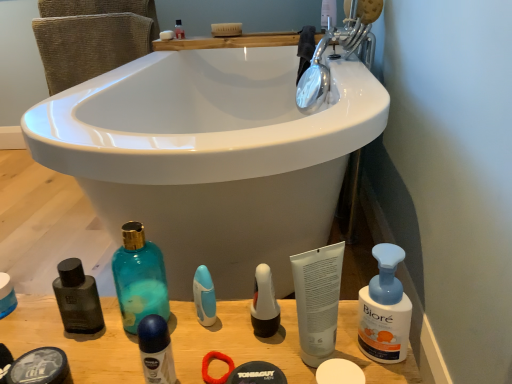
Where is `vacant area that is situated to the right of blue plastic toothbrush at center, which appears as the 3th toiletry when viewed from the right`? vacant area that is situated to the right of blue plastic toothbrush at center, which appears as the 3th toiletry when viewed from the right is located at coordinates (289, 333).